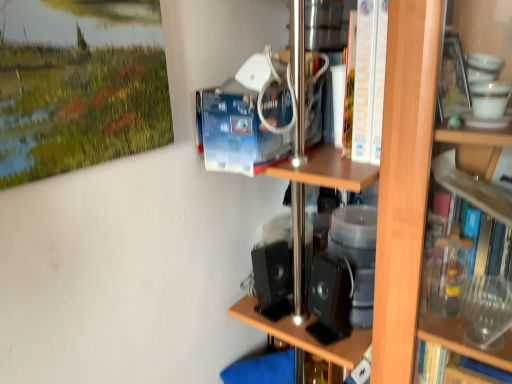
I want to click on blank space above blue cardboard box at upper center (from a real-world perspective), so click(252, 84).